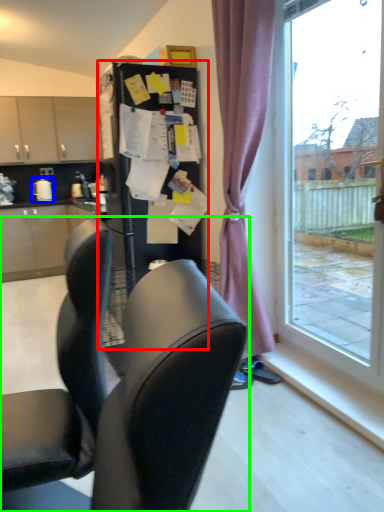
Question: Which object is the farthest from fridge (highlighted by a red box)? Choose among these: appliance (highlighted by a blue box) or chair (highlighted by a green box).

Choices:
 (A) appliance
 (B) chair

Answer: (A)